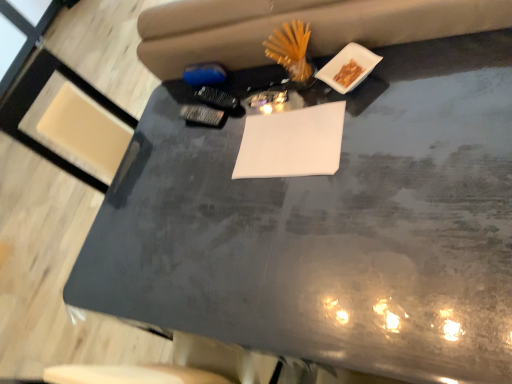
Identify the location of vacant space behind white paper at center. The image size is (512, 384). (244, 113).